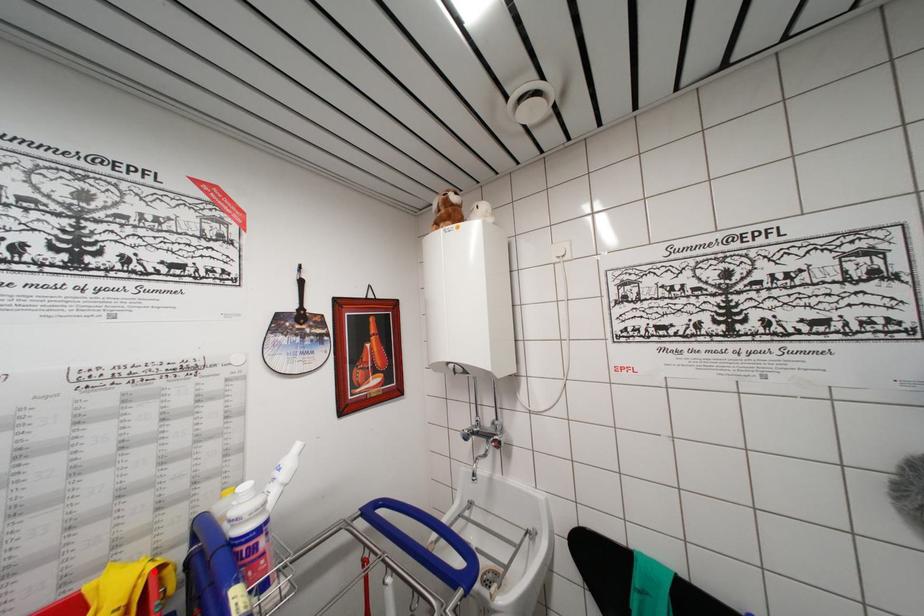
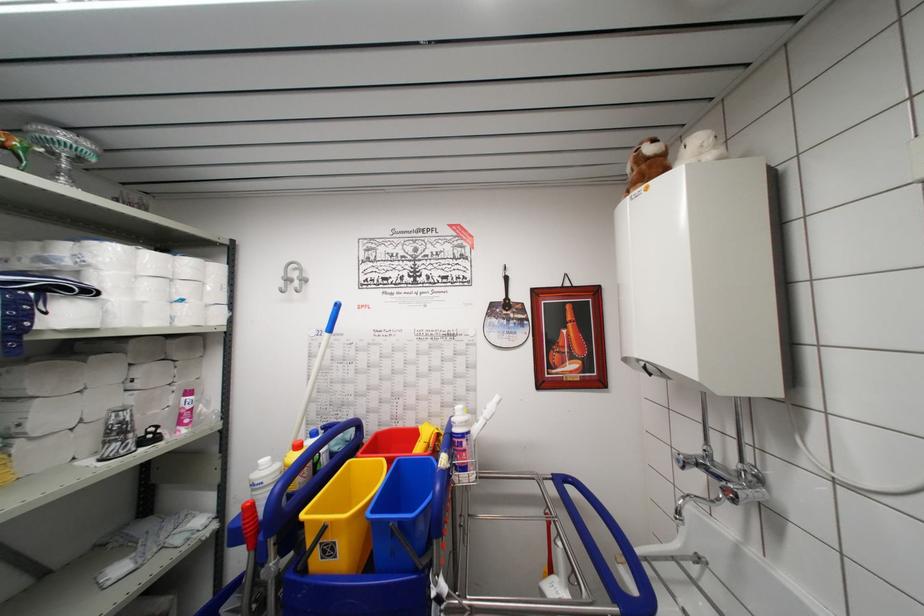
Where in the second image is the point corresponding to the highlighted location from the first image?

(439, 436)